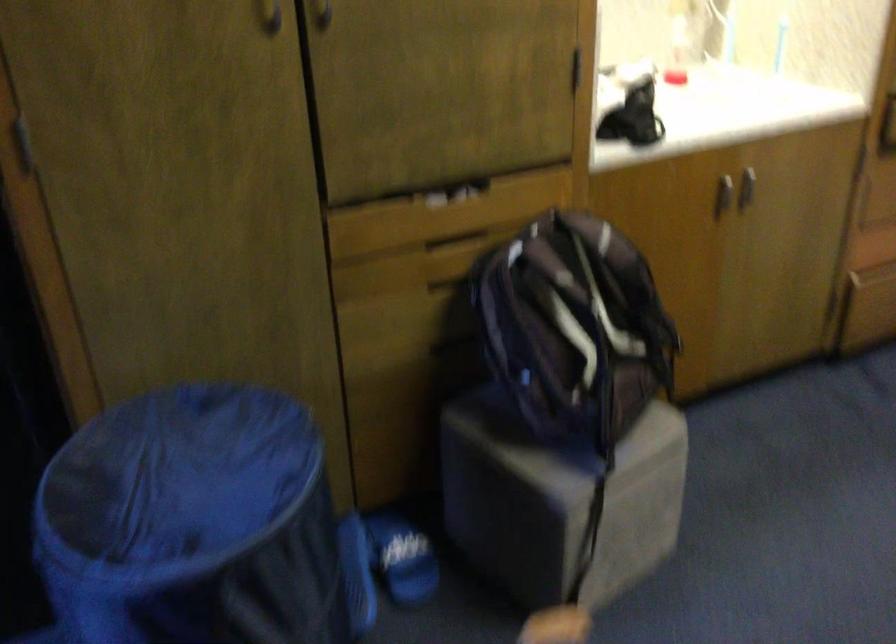
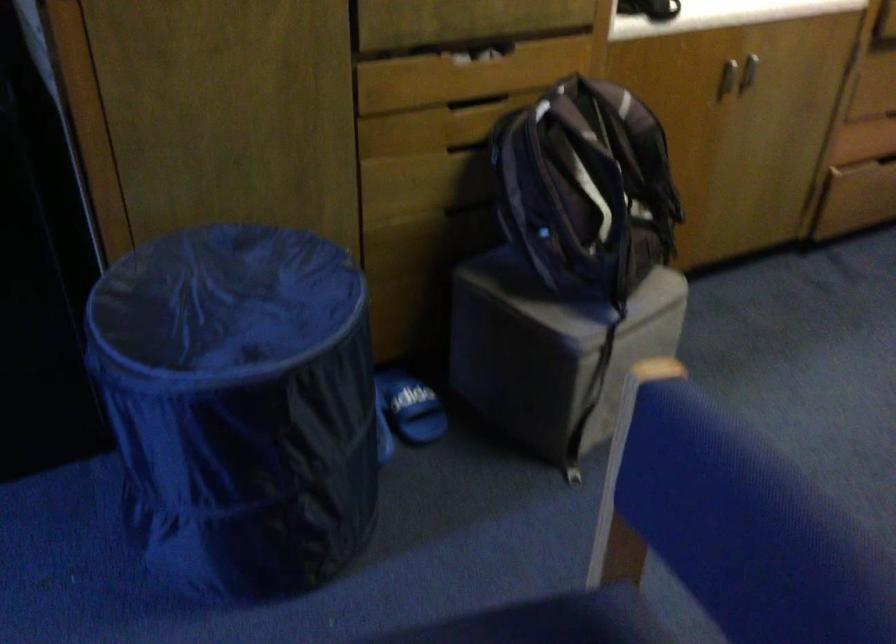
The point at (721, 202) is marked in the first image. Where is the corresponding point in the second image?

(728, 79)